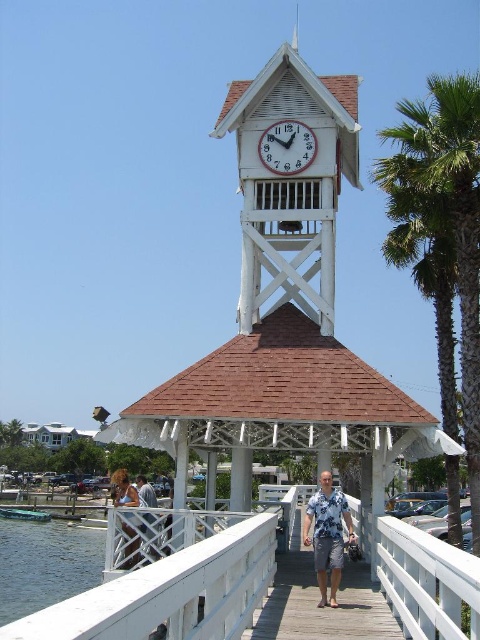
Question: Considering the real-world distances, which object is closest to the white wooden clock tower at center?

Choices:
 (A) floral shirt at center
 (B) white wood gazebo at center
 (C) green leafy palm tree at right
 (D) brown hair at center

Answer: (B)

Question: Which is nearer to the clear water at lower left?

Choices:
 (A) light blue shirt at center
 (B) brown hair at center
 (C) white wooden clock at center
 (D) white wood gazebo at center

Answer: (A)

Question: Which of these objects is positioned closest to the white wooden clock at center?

Choices:
 (A) white wooden clock tower at center
 (B) white wood gazebo at center

Answer: (A)

Question: Does white wood gazebo at center come behind clear water at lower left?

Choices:
 (A) yes
 (B) no

Answer: (B)

Question: Is clear water at lower left wider than white wooden clock at center?

Choices:
 (A) no
 (B) yes

Answer: (B)

Question: Is white wood gazebo at center to the left of white wooden clock at center from the viewer's perspective?

Choices:
 (A) no
 (B) yes

Answer: (A)